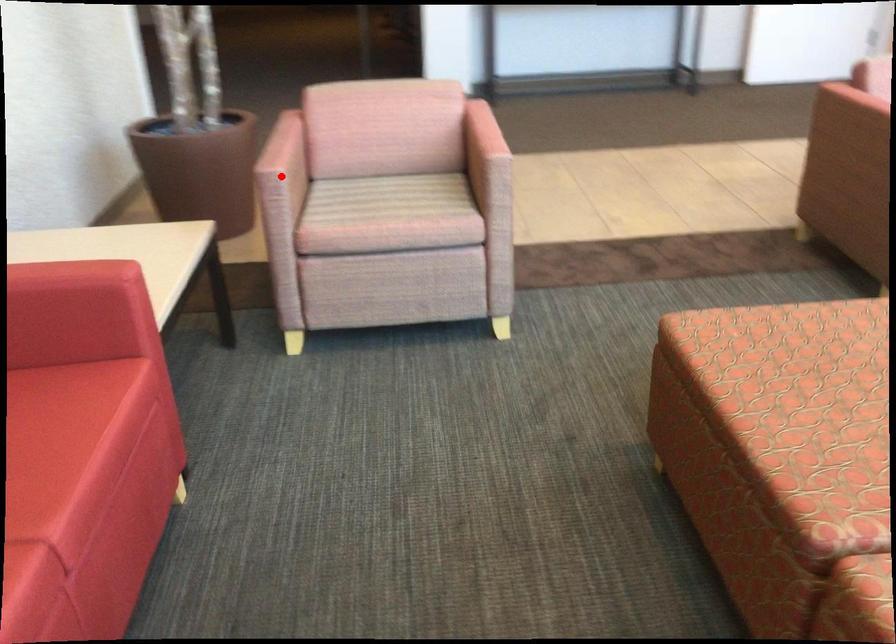
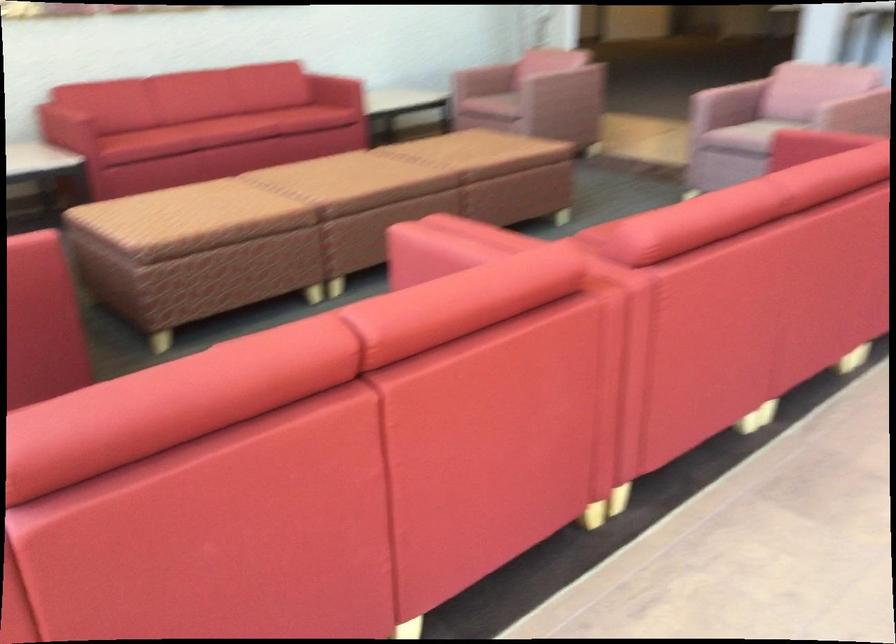
Question: I am providing you with two images of the same scene from different viewpoints. A red point is marked on the first image. Can you still see the location of the red point in image 2?

Choices:
 (A) Yes
 (B) No

Answer: (B)